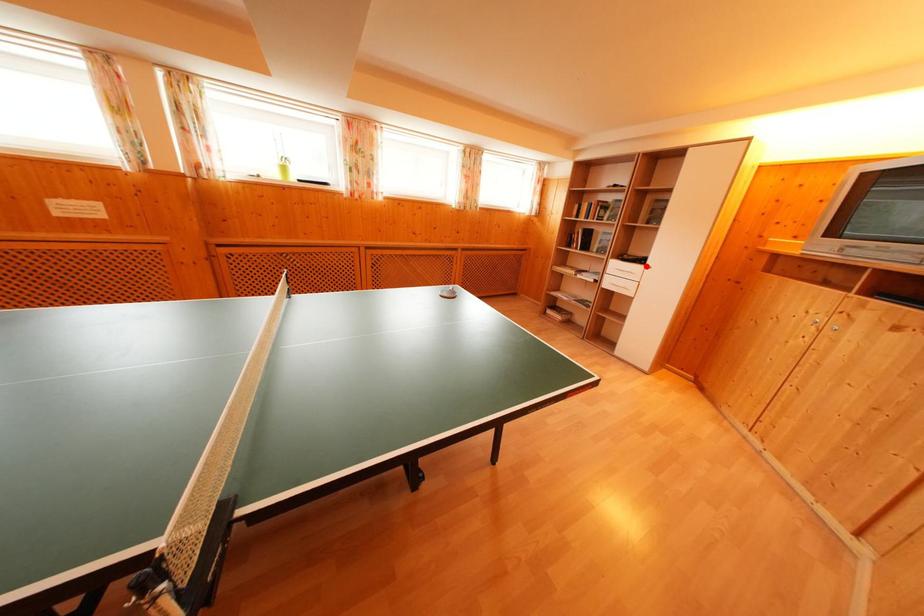
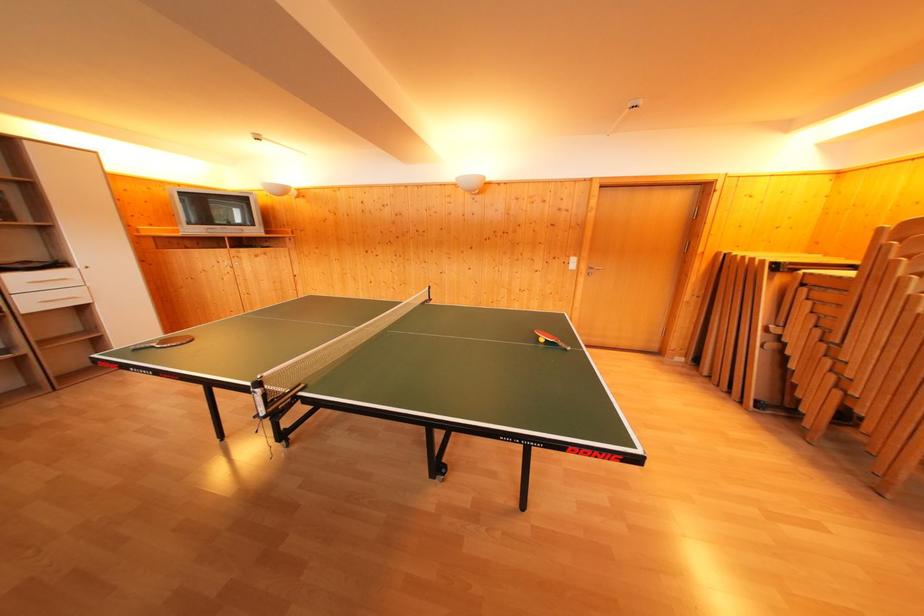
In the second image, find the point that corresponds to the highlighted location in the first image.

(64, 270)